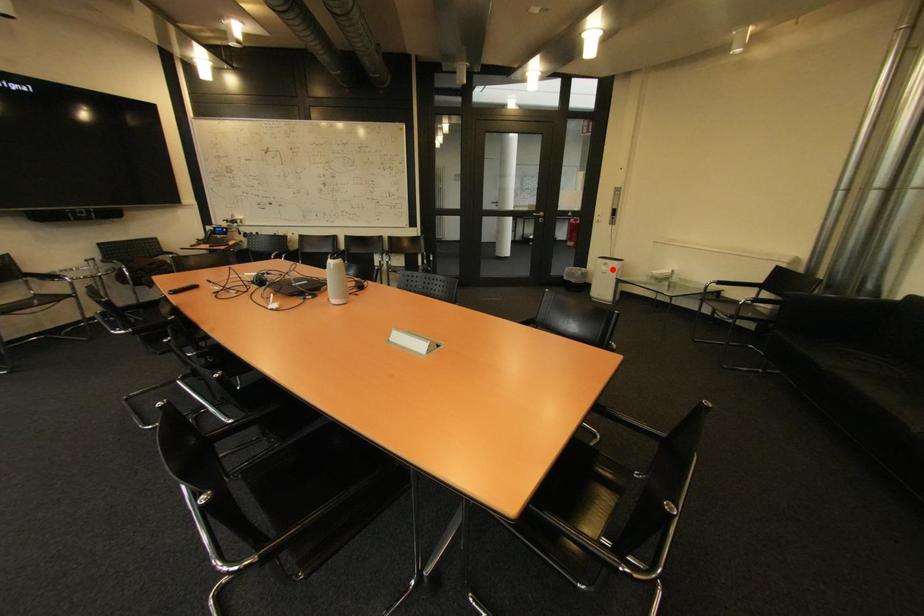
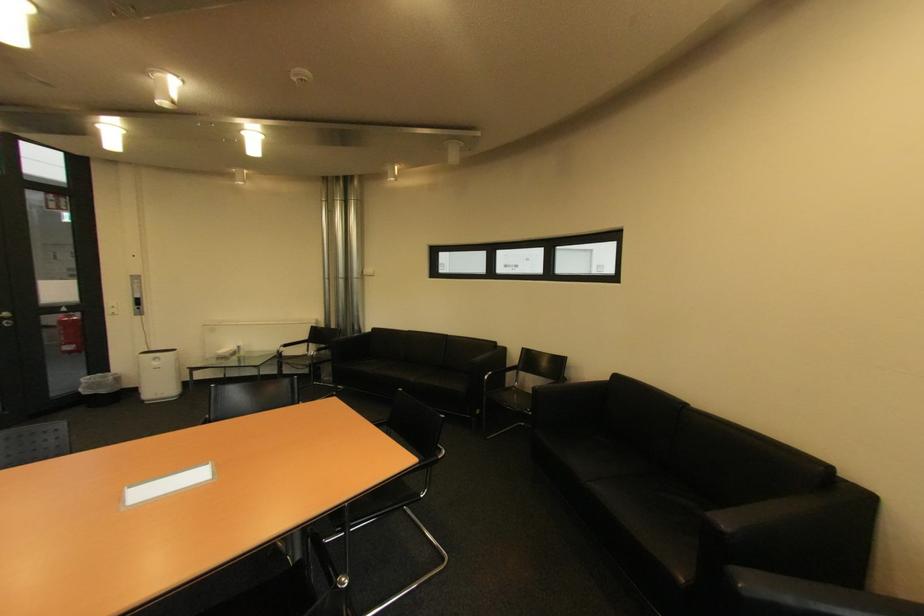
Question: I am providing you with two images of the same scene from different viewpoints. In image1, a red point is highlighted. Considering the same 3D point in image2, which of the following is correct?

Choices:
 (A) It is closer
 (B) It is farther

Answer: (B)